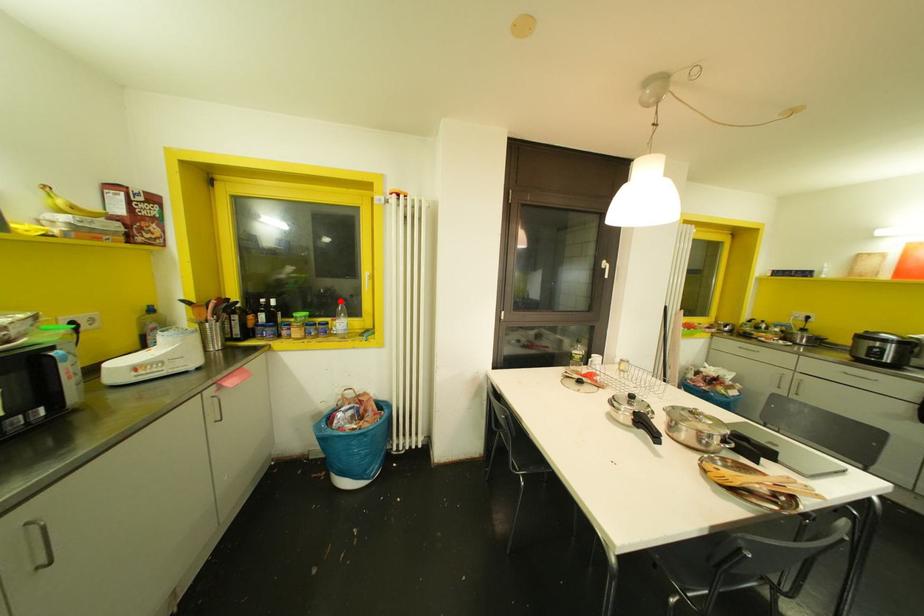
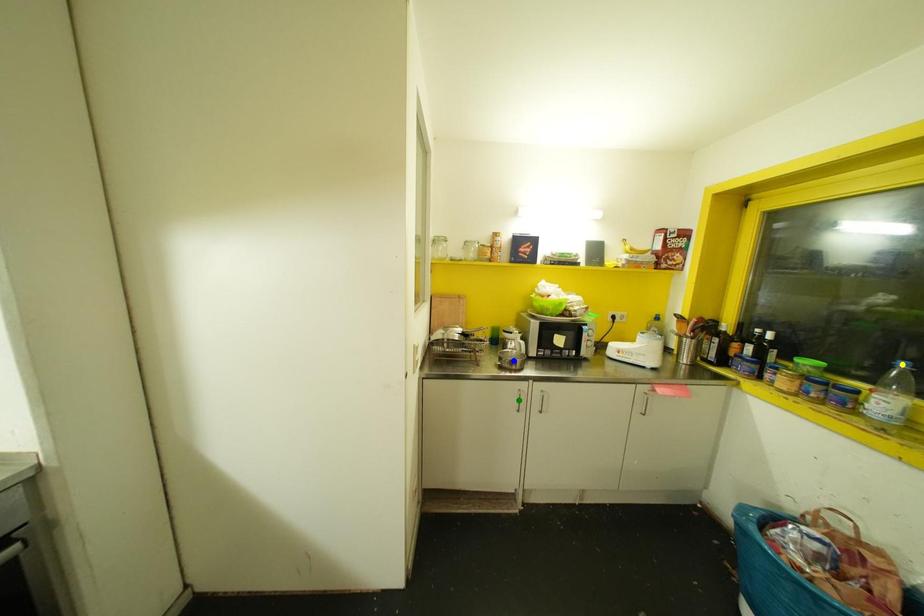
Question: I am providing you with two images of the same scene from different viewpoints. A red point is marked on the first image. You are given multiple points on the second image. Which mark in image 2 goes with the point in image 1?

Choices:
 (A) yellow point
 (B) blue point
 (C) green point

Answer: (A)